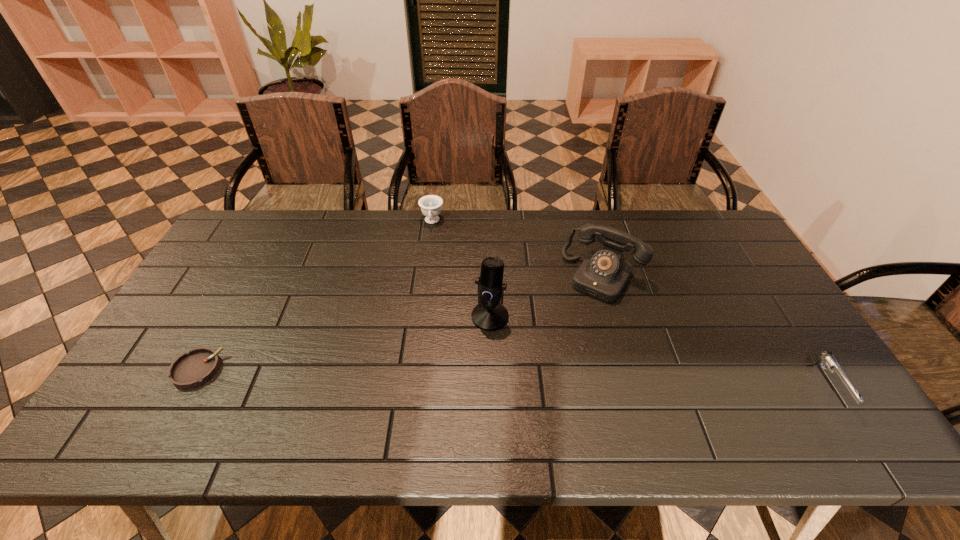
This screenshot has height=540, width=960. In order to click on free space on the desktop that is between the ashtray and the pistol and is positioned on the dial of the telephone in this screenshot , I will do click(540, 378).

Where is `vacant space on the desktop that is between the shortest object and the pistol and is positioned on the stand of the microphone`? This screenshot has width=960, height=540. vacant space on the desktop that is between the shortest object and the pistol and is positioned on the stand of the microphone is located at coordinates (445, 375).

Locate an element on the screen. This screenshot has width=960, height=540. free space on the desktop that is between the shortest object and the rightmost object and is positioned on the side of the farthest object with the handle is located at coordinates (416, 375).